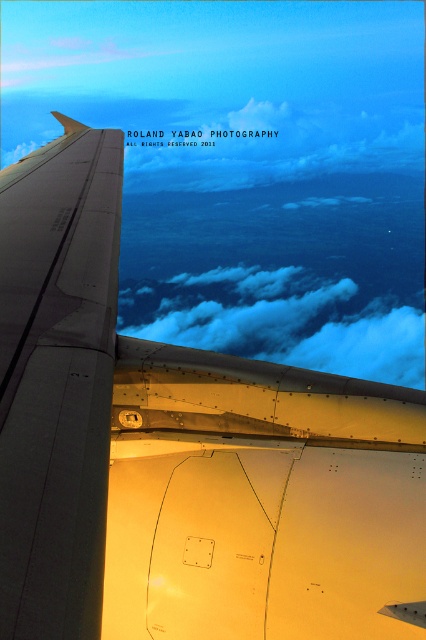
You are sitting in an airplane seat and looking out the window. You see the matte gray wing at left and the cloudy sky at upper center. Which object is nearer to you?

The matte gray wing at left is closer to the viewer than the cloudy sky at upper center.

You are a passenger seated in an airplane and looking out the window. You notice a point marked at coordinates (x=57, y=380). Based on the scene, what object does this point correspond to?

The point at coordinates (x=57, y=380) corresponds to the matte gray wing at left as described in the scene.

You are seated in an airplane and want to take a photo of the matte gray wing at left through the window. If your camera is 80.71 centimeters away from the wing, is it within the recommended 1 meter distance for clear shots?

The matte gray wing at left and camera are 80.71 centimeters apart, which is within the recommended 1 meter distance for clear shots.